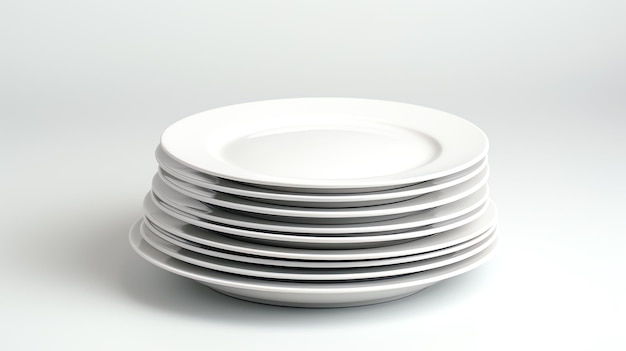
Find the location of a particular element. The width and height of the screenshot is (626, 351). white plates is located at coordinates (298, 294), (317, 279), (319, 267), (322, 257), (327, 240), (327, 229), (330, 215), (330, 201), (330, 188).